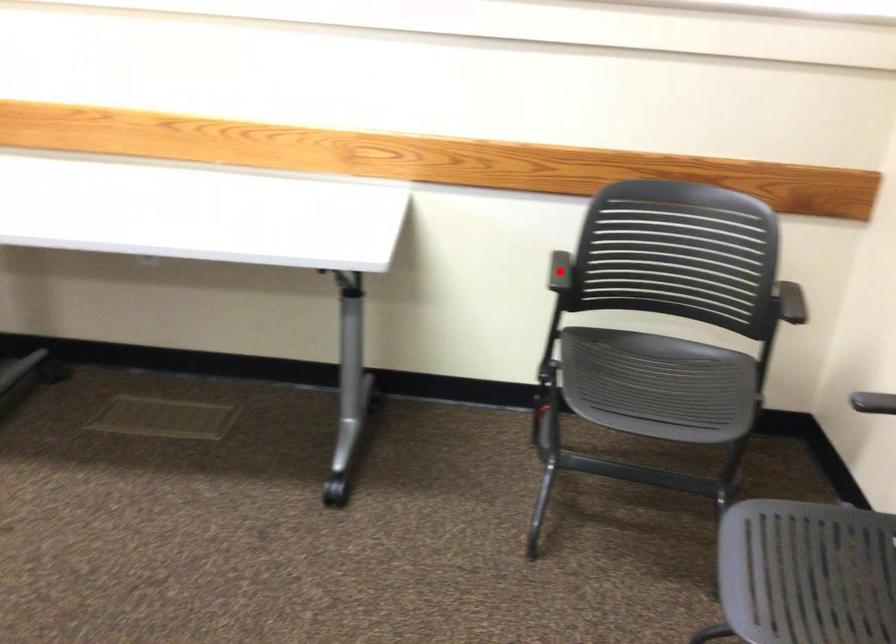
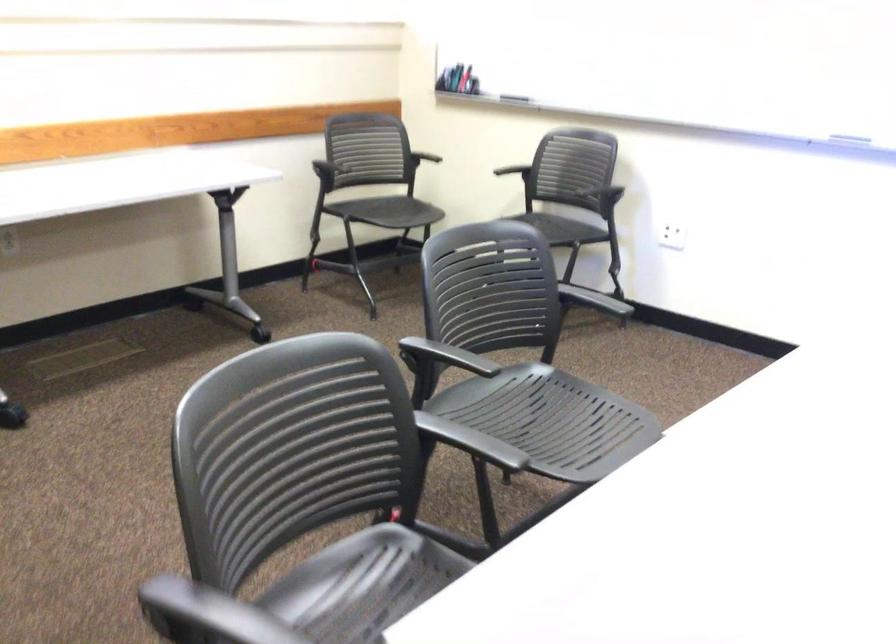
Question: I am providing you with two images of the same scene from different viewpoints. Image1 has a red point marked. In image2, the corresponding 3D location appears at what relative position? Reply with the corresponding letter.

Choices:
 (A) Closer
 (B) Farther

Answer: (B)